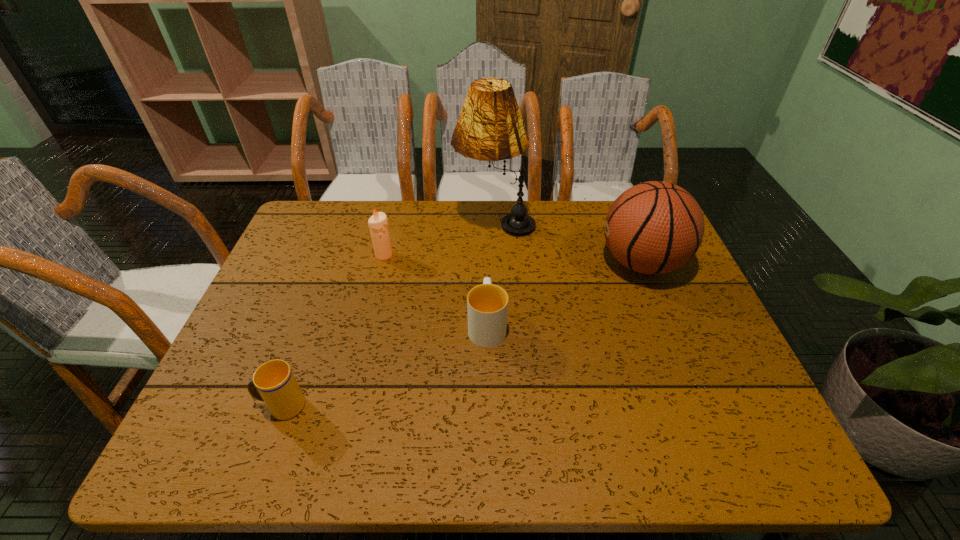
The image size is (960, 540). Identify the location of the tallest object. (490, 127).

In order to click on the rightmost object in this screenshot , I will do `click(655, 227)`.

Locate an element on the screen. The width and height of the screenshot is (960, 540). the fourth shortest object is located at coordinates (655, 227).

This screenshot has height=540, width=960. What are the coordinates of `the second object from left to right` in the screenshot? It's located at (378, 223).

Where is `candle`? candle is located at coordinates (378, 223).

Where is `the farther cup`? The width and height of the screenshot is (960, 540). the farther cup is located at coordinates (487, 304).

The width and height of the screenshot is (960, 540). In order to click on the right cup in this screenshot , I will do `click(487, 304)`.

This screenshot has width=960, height=540. What are the coordinates of `the left cup` in the screenshot? It's located at (274, 383).

Locate an element on the screen. The image size is (960, 540). the nearer cup is located at coordinates (274, 383).

The height and width of the screenshot is (540, 960). Identify the location of free spot located on the front-facing side of the lampshade. (425, 222).